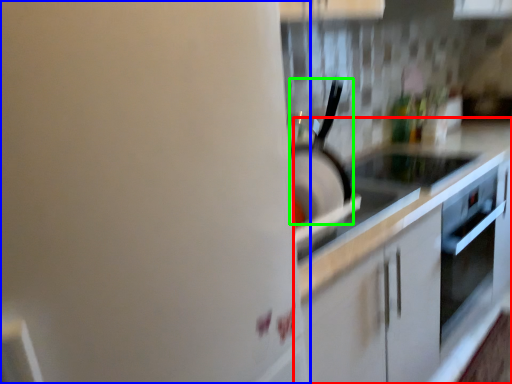
Question: Considering the real-world distances, which object is farthest from countertop (highlighted by a red box)? home appliance (highlighted by a blue box) or kitchen appliance (highlighted by a green box)?

Choices:
 (A) home appliance
 (B) kitchen appliance

Answer: (A)